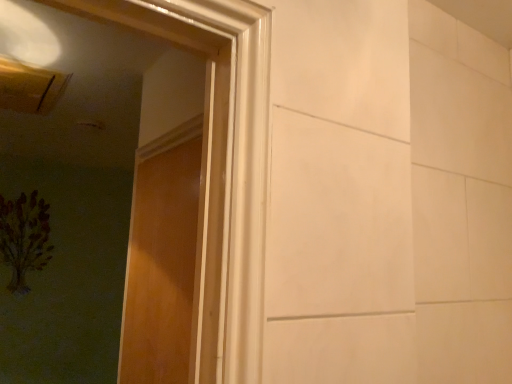
Describe the element at coordinates (161, 267) in the screenshot. I see `wooden door at left` at that location.

You are a GUI agent. You are given a task and a screenshot of the screen. Output one action in this format:
    pyautogui.click(x=<x>, y=<y>)
    Task: Click on the wooden door at left
    This screenshot has width=512, height=384.
    Given the screenshot: What is the action you would take?
    pyautogui.click(x=161, y=267)

In order to face wooden door at left, should I rotate leftwards or rightwards?

To align with it, rotate left about 12.845°.

Measure the distance between point (x=34, y=222) and camera.

The distance of point (x=34, y=222) from camera is 3.19 meters.

What do you see at coordinates (24, 237) in the screenshot?
I see `brown textured painting at left` at bounding box center [24, 237].

Locate an element on the screen. brown textured painting at left is located at coordinates (24, 237).

I want to click on wooden door at left, so click(x=161, y=267).

Between wooden door at left and brown textured painting at left, which one appears on the right side from the viewer's perspective?

Positioned to the right is wooden door at left.

Which object is more forward, wooden door at left or brown textured painting at left?

wooden door at left is in front.

Between point (160, 199) and point (23, 287), which one is positioned in front?

The point (160, 199) is more forward.

From the image's perspective, which one is positioned lower, wooden door at left or brown textured painting at left?

brown textured painting at left.

In the scene shown: From a real-world perspective, is wooden door at left positioned above or below brown textured painting at left?

wooden door at left is situated lower than brown textured painting at left in the real world.

Can you confirm if wooden door at left is thinner than brown textured painting at left?

Yes, wooden door at left is thinner than brown textured painting at left.

Considering the relative sizes of wooden door at left and brown textured painting at left in the image provided, is wooden door at left taller than brown textured painting at left?

Correct, wooden door at left is much taller as brown textured painting at left.

From the picture: In terms of size, does wooden door at left appear bigger or smaller than brown textured painting at left?

In the image, wooden door at left appears to be smaller than brown textured painting at left.

Is wooden door at left inside the boundaries of brown textured painting at left, or outside?

wooden door at left is outside brown textured painting at left.

Is wooden door at left touching brown textured painting at left?

No, wooden door at left is not making contact with brown textured painting at left.

Is wooden door at left aimed at brown textured painting at left?

No, wooden door at left is not facing towards brown textured painting at left.

Can you tell me how much wooden door at left and brown textured painting at left differ in facing direction?

The angle between the facing direction of wooden door at left and the facing direction of brown textured painting at left is 89.5 degrees.

Measure the distance between wooden door at left and brown textured painting at left.

2.22 meters.

You are a GUI agent. You are given a task and a screenshot of the screen. Output one action in this format:
    pyautogui.click(x=<x>, y=<y>)
    Task: Click on the door on the right side of brown textured painting at left
    This screenshot has width=512, height=384.
    Given the screenshot: What is the action you would take?
    pyautogui.click(x=161, y=267)

Is brown textured painting at left to the right of wooden door at left from the viewer's perspective?

No, brown textured painting at left is not to the right of wooden door at left.

Considering the relative positions of brown textured painting at left and wooden door at left in the image provided, is brown textured painting at left in front of wooden door at left?

No, brown textured painting at left is further to the viewer.

Which is closer, [4,210] or [154,141]?

Positioned in front is point [154,141].

From the image's perspective, is brown textured painting at left under wooden door at left?

Yes.

From a real-world perspective, is brown textured painting at left beneath wooden door at left?

No, from a real-world perspective, brown textured painting at left is not beneath wooden door at left.

Can you confirm if brown textured painting at left is thinner than wooden door at left?

No.

Considering the relative sizes of brown textured painting at left and wooden door at left in the image provided, is brown textured painting at left taller than wooden door at left?

No.

Based on their sizes in the image, would you say brown textured painting at left is bigger or smaller than wooden door at left?

Clearly, brown textured painting at left is larger in size than wooden door at left.

Which is correct: brown textured painting at left is inside wooden door at left, or outside of it?

brown textured painting at left is outside wooden door at left.

Is brown textured painting at left with wooden door at left?

No, brown textured painting at left is not making contact with wooden door at left.

Is brown textured painting at left facing towards wooden door at left?

Yes, brown textured painting at left is facing wooden door at left.

Can you tell me how much brown textured painting at left and wooden door at left differ in facing direction?

The angle between the facing direction of brown textured painting at left and the facing direction of wooden door at left is 89.5 degrees.

Measure the distance between brown textured painting at left and wooden door at left.

brown textured painting at left is 2.22 meters from wooden door at left.

Identify the location of door that is on the right side of brown textured painting at left. (161, 267).

The height and width of the screenshot is (384, 512). Find the location of `door in front of the brown textured painting at left`. door in front of the brown textured painting at left is located at coordinates (161, 267).

Identify the location of door above the brown textured painting at left (from the image's perspective). This screenshot has width=512, height=384. 161,267.